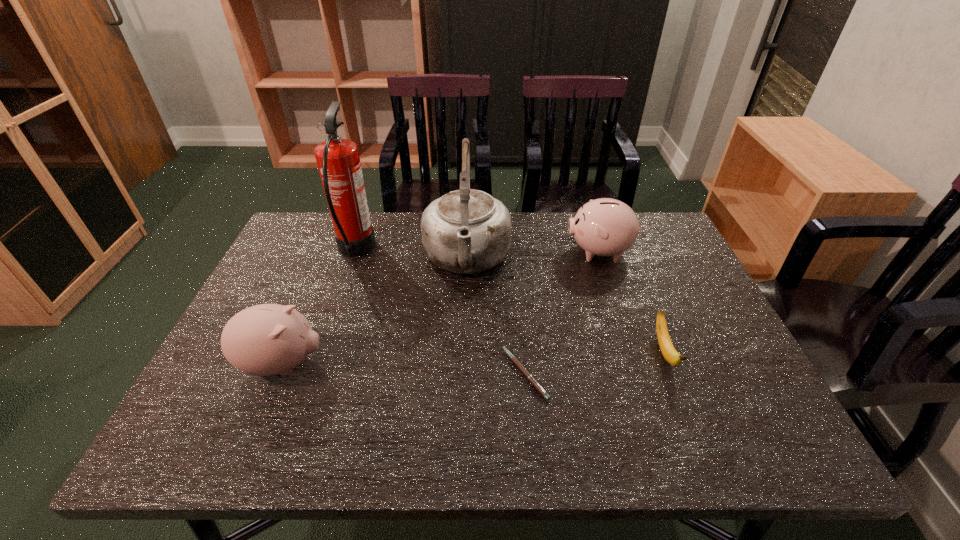
At what (x,y) coordinates should I click in order to perform the action: click on fire extinguisher. Please return your answer as a coordinate pair (x, y). Looking at the image, I should click on pyautogui.click(x=338, y=161).

This screenshot has width=960, height=540. I want to click on the second tallest object, so click(467, 231).

Identify the location of the farther piggy bank. (604, 227).

You are a GUI agent. You are given a task and a screenshot of the screen. Output one action in this format:
    pyautogui.click(x=<x>, y=<y>)
    Task: Click on the nearer piggy bank
    The height and width of the screenshot is (540, 960).
    Given the screenshot: What is the action you would take?
    pyautogui.click(x=268, y=339)

Where is `the fifth tallest object`? the fifth tallest object is located at coordinates (668, 351).

The image size is (960, 540). I want to click on pen, so click(530, 378).

Where is `vacant region located on the front-facing side of the tallest object`? The image size is (960, 540). vacant region located on the front-facing side of the tallest object is located at coordinates (435, 251).

This screenshot has height=540, width=960. In order to click on free space located 0.390m at the spout of the kettle in this screenshot , I will do `click(461, 433)`.

Find the location of `vacant area situated on the left of the right piggy bank`. vacant area situated on the left of the right piggy bank is located at coordinates (433, 252).

Locate an element on the screen. This screenshot has height=540, width=960. vacant space located at the snout of the left piggy bank is located at coordinates (504, 364).